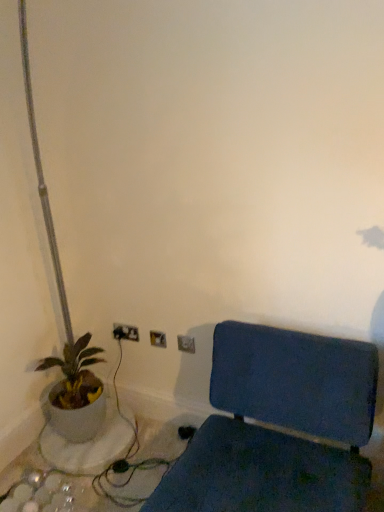
Question: Is metallic silver electric outlet at upper center, arranged as the first electric outlet when viewed from the right, facing away from metallic silver electric outlet at lower center, which is the 3th electric outlet in right-to-left order?

Choices:
 (A) no
 (B) yes

Answer: (A)

Question: Can you confirm if metallic silver electric outlet at upper center, acting as the 1th electric outlet starting from the front, is bigger than metallic silver electric outlet at lower center, which is the 3th electric outlet in right-to-left order?

Choices:
 (A) no
 (B) yes

Answer: (A)

Question: Can you confirm if metallic silver electric outlet at upper center, the third electric outlet when ordered from back to front, is smaller than metallic silver electric outlet at lower center, the third electric outlet in the front-to-back sequence?

Choices:
 (A) yes
 (B) no

Answer: (A)

Question: Is the surface of metallic silver electric outlet at upper center, which is the 3th electric outlet in left-to-right order, in direct contact with metallic silver electric outlet at lower center, placed as the 1th electric outlet when sorted from back to front?

Choices:
 (A) no
 (B) yes

Answer: (A)

Question: Is metallic silver electric outlet at upper center, the third electric outlet when ordered from back to front, wider than metallic silver electric outlet at lower center, placed as the 1th electric outlet when sorted from back to front?

Choices:
 (A) yes
 (B) no

Answer: (A)

Question: Relative to metallic silver electric outlet at lower center, the third electric outlet in the front-to-back sequence, is metallic silver electric outlet at upper center, arranged as the first electric outlet when viewed from the right, in front or behind?

Choices:
 (A) behind
 (B) front

Answer: (B)

Question: Considering the positions of metallic silver electric outlet at upper center, acting as the 1th electric outlet starting from the front, and metallic silver electric outlet at lower center, which is the 3th electric outlet in right-to-left order, in the image, is metallic silver electric outlet at upper center, acting as the 1th electric outlet starting from the front, bigger or smaller than metallic silver electric outlet at lower center, which is the 3th electric outlet in right-to-left order,?

Choices:
 (A) small
 (B) big

Answer: (A)

Question: From the image's perspective, is metallic silver electric outlet at upper center, which is the 3th electric outlet in left-to-right order, above or below metallic silver electric outlet at lower center, the 1th electric outlet in the left-to-right sequence?

Choices:
 (A) below
 (B) above

Answer: (A)

Question: Would you say metallic silver electric outlet at upper center, acting as the 1th electric outlet starting from the front, is inside or outside metallic silver electric outlet at lower center, placed as the 1th electric outlet when sorted from back to front?

Choices:
 (A) outside
 (B) inside

Answer: (A)

Question: In the image, is metallic silver electric outlet at upper center, the third electric outlet when ordered from back to front, on the left side or the right side of blue fabric chair at lower right?

Choices:
 (A) left
 (B) right

Answer: (A)

Question: Is point (182, 351) positioned closer to the camera than point (246, 452)?

Choices:
 (A) closer
 (B) farther

Answer: (B)

Question: From a real-world perspective, is metallic silver electric outlet at upper center, arranged as the first electric outlet when viewed from the right, above or below blue fabric chair at lower right?

Choices:
 (A) above
 (B) below

Answer: (A)

Question: In terms of height, does metallic silver electric outlet at upper center, which is the 3th electric outlet in left-to-right order, look taller or shorter compared to blue fabric chair at lower right?

Choices:
 (A) tall
 (B) short

Answer: (B)

Question: Considering the positions of blue fabric chair at lower right and metallic silver electric outlet at upper center, arranged as the first electric outlet when viewed from the right, in the image, is blue fabric chair at lower right taller or shorter than metallic silver electric outlet at upper center, arranged as the first electric outlet when viewed from the right,?

Choices:
 (A) tall
 (B) short

Answer: (A)

Question: Which is correct: blue fabric chair at lower right is inside metallic silver electric outlet at upper center, acting as the 1th electric outlet starting from the front, or outside of it?

Choices:
 (A) outside
 (B) inside

Answer: (A)